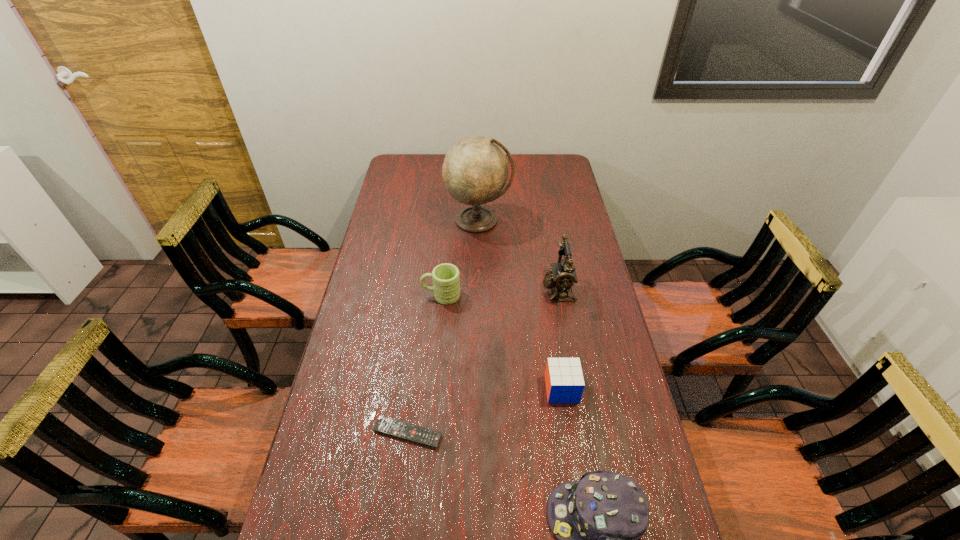
Identify the location of vacant region between the third nearest object and the farthest object. The width and height of the screenshot is (960, 540). (520, 305).

Where is `vacant space that's between the tallest object and the mug`? The image size is (960, 540). vacant space that's between the tallest object and the mug is located at coordinates (460, 258).

Where is `free spot between the second tallest object and the remote control`? free spot between the second tallest object and the remote control is located at coordinates (483, 361).

Locate which object ranks third in proximity to the headwear. Please provide its 2D coordinates. Your answer should be formatted as a tuple, i.e. [(x, y)], where the tuple contains the x and y coordinates of a point satisfying the conditions above.

[(563, 275)]

Identify the location of object that is the fourth nearest to the headwear. (446, 283).

Locate an element on the screen. Image resolution: width=960 pixels, height=540 pixels. vacant position in the image that satisfies the following two spatial constraints: 1. on the front-facing side of the tallest object; 2. on the left side of the cube is located at coordinates (478, 389).

Locate an element on the screen. This screenshot has height=540, width=960. vacant space that satisfies the following two spatial constraints: 1. on the front-facing side of the globe; 2. on the side of the mug with the handle is located at coordinates (478, 295).

Find the location of `free location that satisfies the following two spatial constraints: 1. on the front-facing side of the farthest object; 2. on the right side of the second shortest object`. free location that satisfies the following two spatial constraints: 1. on the front-facing side of the farthest object; 2. on the right side of the second shortest object is located at coordinates (478, 389).